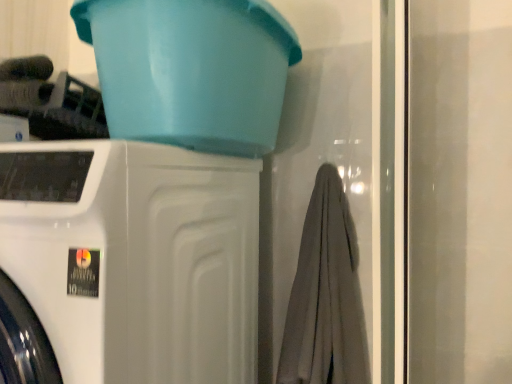
Question: From their relative heights in the image, would you say white glossy washing machine at left is taller or shorter than gray cotton bath towel at center?

Choices:
 (A) short
 (B) tall

Answer: (B)

Question: From a real-world perspective, is white glossy washing machine at left above or below gray cotton bath towel at center?

Choices:
 (A) above
 (B) below

Answer: (B)

Question: Estimate the real-world distances between objects in this image. Which object is farther from the white glossy washing machine at left?

Choices:
 (A) matte plastic basin at upper center
 (B) gray cotton bath towel at center

Answer: (B)

Question: Which of these objects is positioned farthest from the white glossy washing machine at left?

Choices:
 (A) matte plastic basin at upper center
 (B) gray cotton bath towel at center

Answer: (B)